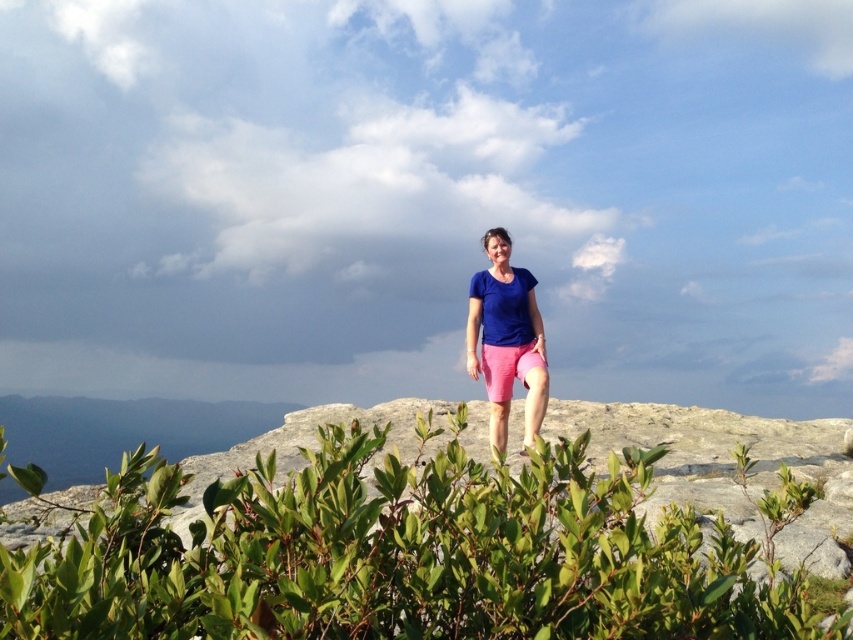
Does green leafy shrub at center have a greater width compared to matte blue t-shirt at center?

Correct, the width of green leafy shrub at center exceeds that of matte blue t-shirt at center.

Is point (555, 481) more distant than point (480, 310)?

That is False.

Measure the distance between point (26, 573) and camera.

The distance of point (26, 573) from camera is 5.12 feet.

Image resolution: width=853 pixels, height=640 pixels. In order to click on green leafy shrub at center in this screenshot , I will do `click(405, 554)`.

Can you confirm if green leafy shrub at center is bigger than pink cotton shorts at center?

Correct, green leafy shrub at center is larger in size than pink cotton shorts at center.

Does green leafy shrub at center have a greater width compared to pink cotton shorts at center?

Yes.

Is point (405, 541) positioned in front of point (520, 380)?

Yes, it is.

Where is `green leafy shrub at center`? This screenshot has width=853, height=640. green leafy shrub at center is located at coordinates (405, 554).

Between point (498, 435) and point (486, 342), which one is positioned in front?

Point (498, 435) is more forward.

Can you confirm if matte blue t-shirt at center is wider than pink cotton shorts at center?

Yes.

Is point (537, 412) farther from viewer compared to point (508, 380)?

No.

The height and width of the screenshot is (640, 853). Identify the location of matte blue t-shirt at center. (506, 339).